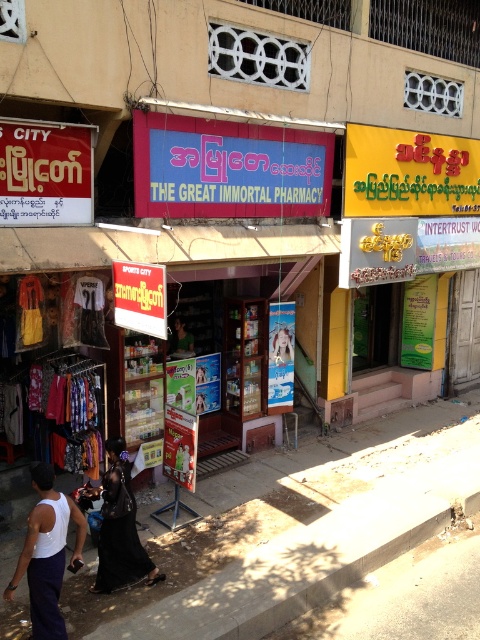
You are a customer looking to buy a shirt. You see the white fabric tank top at lower left and the matte black shirt at center. Which one is located lower in the image?

The white fabric tank top at lower left is positioned under the matte black shirt at center, so it is located lower in the image.

You are standing at the point labeled as point (228, 168) in the image. What object are you touching?

You are touching the blue matte sign at center because the point (228, 168) is on it.

You are standing on the street looking at the building with the red signboard. There are two points marked on the building facade. Which point is closer to you, point at coordinate [83,536] or point at coordinate [175,346]?

Point at coordinate [83,536] is closer to you than point at coordinate [175,346].